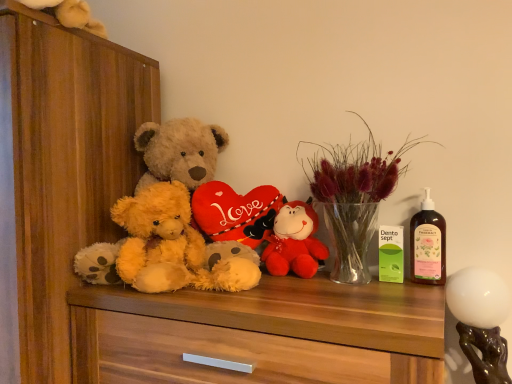
Question: Does soft brown plush at center have a greater width compared to white glossy lampshade at right, the 1th toy viewed from the right?

Choices:
 (A) no
 (B) yes

Answer: (B)

Question: Does soft brown plush at center appear on the right side of white glossy lampshade at right, the 1th toy viewed from the front?

Choices:
 (A) no
 (B) yes

Answer: (A)

Question: Is soft brown plush at center further to camera compared to white glossy lampshade at right, the 1th toy viewed from the right?

Choices:
 (A) yes
 (B) no

Answer: (A)

Question: Would you say white glossy lampshade at right, which is the 2th toy in top-to-bottom order, is part of soft brown plush at center's contents?

Choices:
 (A) yes
 (B) no

Answer: (B)

Question: From a real-world perspective, is soft brown plush at center on white glossy lampshade at right, acting as the second toy starting from the back?

Choices:
 (A) no
 (B) yes

Answer: (B)

Question: Does soft brown plush at center appear on the left side of white glossy lampshade at right, the 1th toy positioned from the bottom?

Choices:
 (A) yes
 (B) no

Answer: (A)

Question: Considering the relative sizes of white glossy lampshade at right, the 1th toy viewed from the front, and fluffy yellow teddy bear at center in the image provided, is white glossy lampshade at right, the 1th toy viewed from the front, shorter than fluffy yellow teddy bear at center?

Choices:
 (A) yes
 (B) no

Answer: (B)

Question: Is the depth of white glossy lampshade at right, positioned as the 2th toy in left-to-right order, less than that of fluffy yellow teddy bear at center?

Choices:
 (A) yes
 (B) no

Answer: (A)

Question: Is fluffy yellow teddy bear at center inside white glossy lampshade at right, acting as the second toy starting from the back?

Choices:
 (A) yes
 (B) no

Answer: (B)

Question: Can you confirm if white glossy lampshade at right, which is the 2th toy in top-to-bottom order, is bigger than fluffy yellow teddy bear at center?

Choices:
 (A) no
 (B) yes

Answer: (A)

Question: From a real-world perspective, is white glossy lampshade at right, which is the 2th toy in top-to-bottom order, on fluffy yellow teddy bear at center?

Choices:
 (A) yes
 (B) no

Answer: (B)

Question: Is white glossy lampshade at right, acting as the second toy starting from the back, wider than fluffy yellow teddy bear at center?

Choices:
 (A) yes
 (B) no

Answer: (A)

Question: From the image's perspective, is velvet plush bear at center, acting as the 2th toy starting from the front, beneath fluffy yellow teddy bear at center?

Choices:
 (A) no
 (B) yes

Answer: (B)